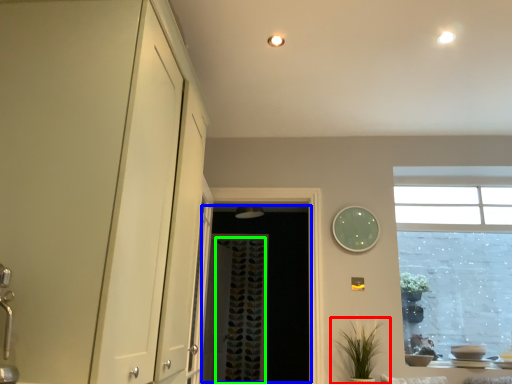
Question: Which object is the farthest from houseplant (highlighted by a red box)? Choose among these: screen door (highlighted by a blue box) or curtain (highlighted by a green box).

Choices:
 (A) screen door
 (B) curtain

Answer: (B)